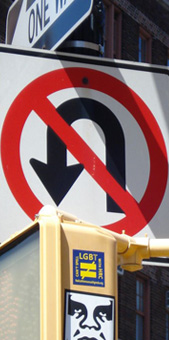
Locate an element on the screen. The height and width of the screenshot is (340, 169). sticker with face on it is located at coordinates (88, 320).